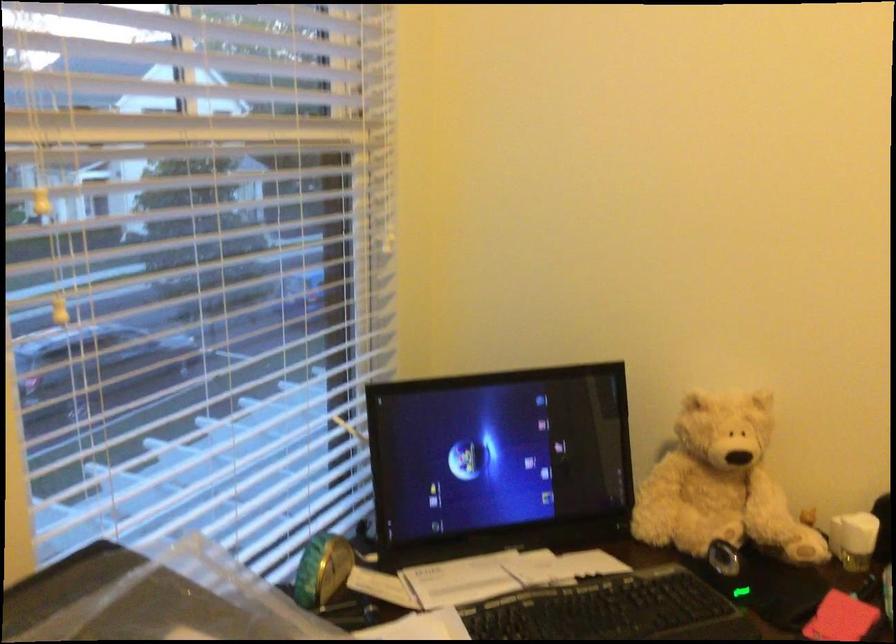
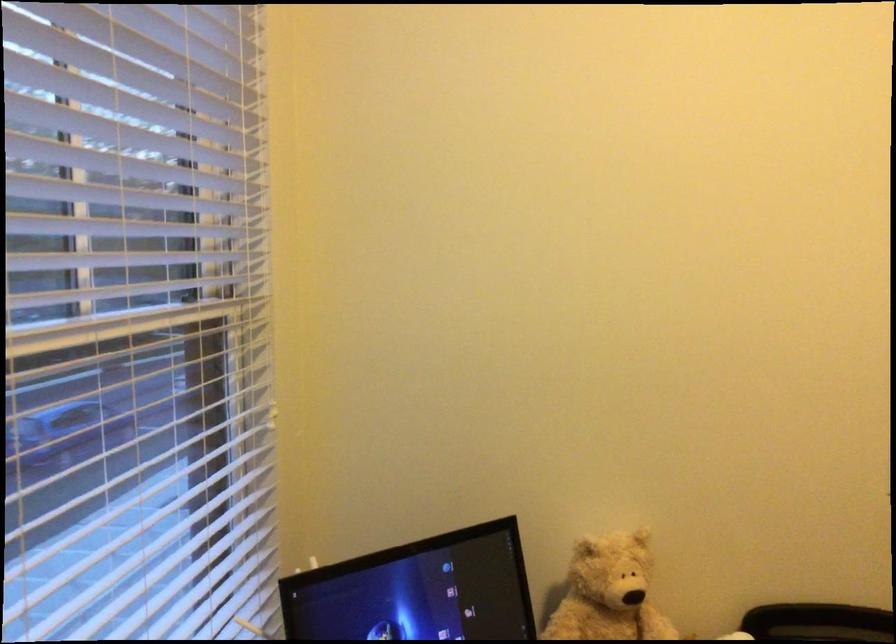
Question: The images are taken continuously from a first-person perspective. In which direction are you moving?

Choices:
 (A) Left
 (B) Right
 (C) Forward
 (D) Backward

Answer: (A)